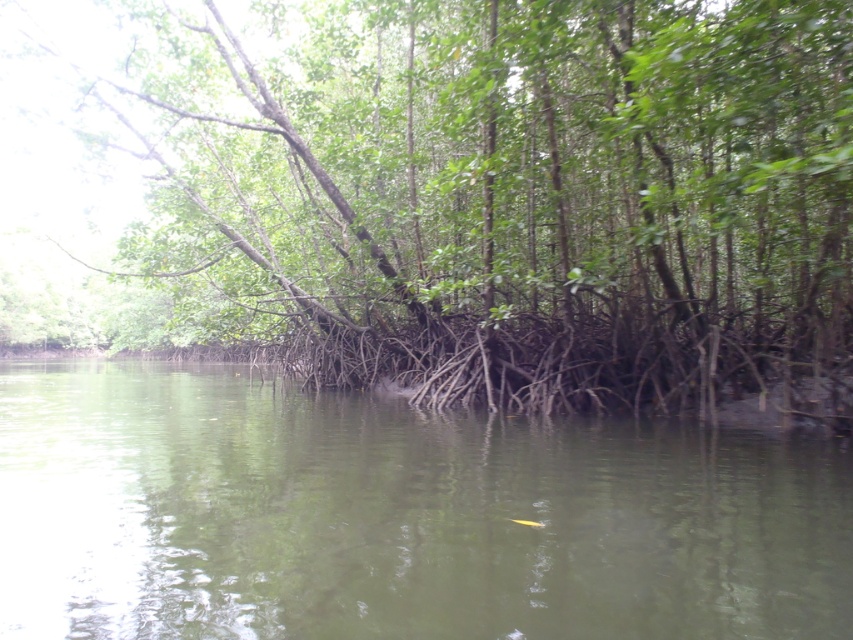
Question: Considering the relative positions of green leafy tree at center and green murky water at center in the image provided, where is green leafy tree at center located with respect to green murky water at center?

Choices:
 (A) above
 (B) below

Answer: (A)

Question: Does green leafy tree at center have a lesser width compared to green murky water at center?

Choices:
 (A) no
 (B) yes

Answer: (A)

Question: Does green leafy tree at center come in front of green murky water at center?

Choices:
 (A) yes
 (B) no

Answer: (B)